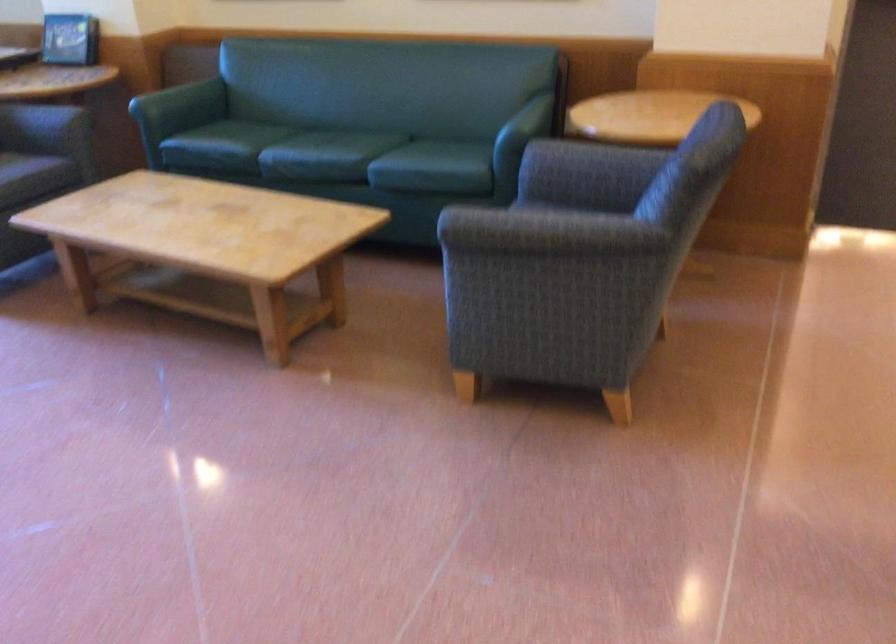
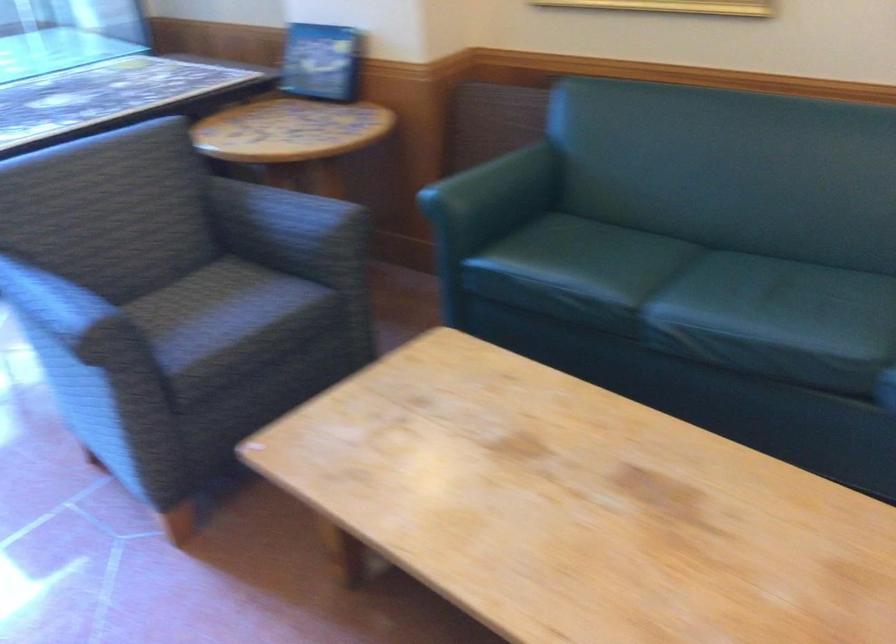
In the second image, find the point that corresponds to point 286,140 in the first image.

(679, 283)